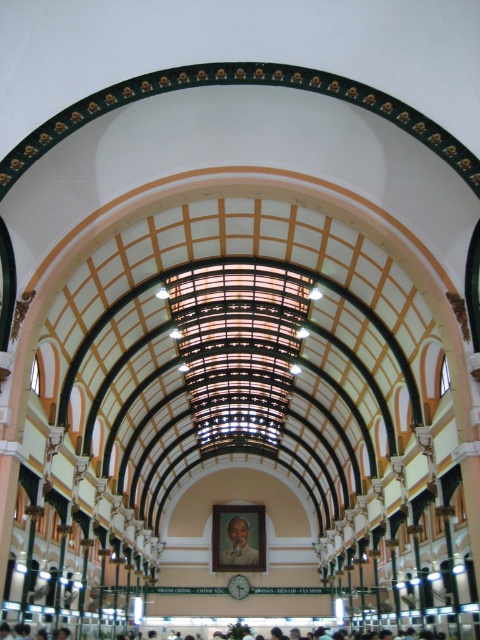
Is smooth skin person at center further to camera compared to smooth brown portrait at center?

No.

Who is more forward, (181, 621) or (245, 538)?

Point (181, 621) is in front.

Does point (294, 621) come behind point (238, 554)?

No, (294, 621) is closer to viewer.

Locate an element on the screen. Image resolution: width=480 pixels, height=640 pixels. smooth skin person at center is located at coordinates (186, 624).